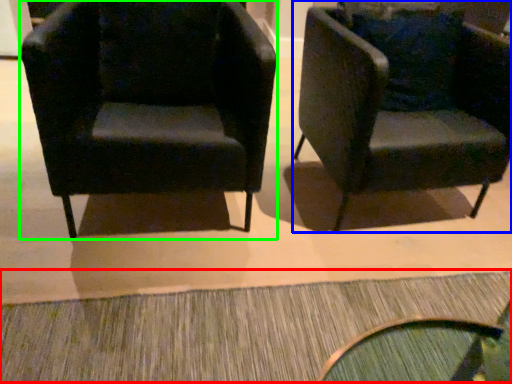
Question: Considering the real-world distances, which object is farthest from doormat (highlighted by a red box)? chair (highlighted by a blue box) or chair (highlighted by a green box)?

Choices:
 (A) chair
 (B) chair

Answer: (A)